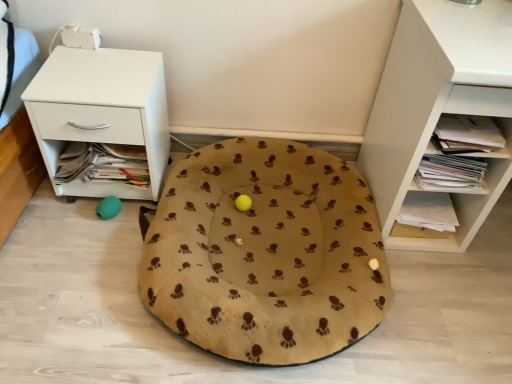
Identify the location of white glossy nightstand at left. Image resolution: width=512 pixels, height=384 pixels. (101, 111).

Find the location of a particular element. The height and width of the screenshot is (384, 512). beige fabric dog bed at center is located at coordinates (265, 253).

Image resolution: width=512 pixels, height=384 pixels. Find the location of `white glossy nightstand at left`. white glossy nightstand at left is located at coordinates (101, 111).

Is white matte shelf at right at the back of white glossy nightstand at left?

No, white glossy nightstand at left is not facing the opposite direction of white matte shelf at right.

From a real-world perspective, is white glossy nightstand at left under white matte shelf at right?

Yes.

Which is farther from the camera, (119, 66) or (435, 46)?

The point (119, 66) is behind.

Which is behind, white glossy nightstand at left or white matte shelf at right?

white glossy nightstand at left is further from the camera.

Which is correct: white matte shelf at right is inside beige fabric dog bed at center, or outside of it?

white matte shelf at right is not enclosed by beige fabric dog bed at center.

Is beige fabric dog bed at center at the back of white matte shelf at right?

That's not correct — white matte shelf at right is not looking away from beige fabric dog bed at center.

Is white matte shelf at right bigger or smaller than beige fabric dog bed at center?

Considering their sizes, white matte shelf at right takes up more space than beige fabric dog bed at center.

Measure the distance between white matte shelf at right and white glossy nightstand at left.

white matte shelf at right is 3.29 feet from white glossy nightstand at left.

Based on the photo, is white matte shelf at right wider or thinner than white glossy nightstand at left?

In the image, white matte shelf at right appears to be wider than white glossy nightstand at left.

Identify the location of nightstand on the left of white matte shelf at right. Image resolution: width=512 pixels, height=384 pixels. (101, 111).

From a real-world perspective, between white glossy nightstand at left and beige fabric dog bed at center, who is vertically higher?

white glossy nightstand at left.

Can you confirm if white glossy nightstand at left is taller than beige fabric dog bed at center?

Correct, white glossy nightstand at left is much taller as beige fabric dog bed at center.

From the image's perspective, does white glossy nightstand at left appear lower than beige fabric dog bed at center?

No, from the image's perspective, white glossy nightstand at left is not below beige fabric dog bed at center.

Does point (83, 140) come closer to viewer compared to point (320, 288)?

No, (83, 140) is behind (320, 288).

From a real-world perspective, is beige fabric dog bed at center above or below white glossy nightstand at left?

beige fabric dog bed at center is situated lower than white glossy nightstand at left in the real world.

Is white glossy nightstand at left at the back of beige fabric dog bed at center?

No, beige fabric dog bed at center's orientation is not away from white glossy nightstand at left.

Which is more to the left, beige fabric dog bed at center or white glossy nightstand at left?

From the viewer's perspective, white glossy nightstand at left appears more on the left side.

Is the surface of beige fabric dog bed at center in direct contact with white matte shelf at right?

No, beige fabric dog bed at center is not touching white matte shelf at right.

Between beige fabric dog bed at center and white matte shelf at right, which one has more height?

With more height is white matte shelf at right.

Is beige fabric dog bed at center at the right side of white matte shelf at right?

In fact, beige fabric dog bed at center is to the left of white matte shelf at right.

The width and height of the screenshot is (512, 384). What are the coordinates of `nightstand above the white matte shelf at right (from the image's perspective)` in the screenshot? It's located at (101, 111).

The width and height of the screenshot is (512, 384). In order to click on dog bed behind the white matte shelf at right in this screenshot , I will do `click(265, 253)`.

When comparing their distances from white glossy nightstand at left, does beige fabric dog bed at center or white matte shelf at right seem closer?

beige fabric dog bed at center.

Considering their positions, is white matte shelf at right positioned closer to white glossy nightstand at left than beige fabric dog bed at center?

beige fabric dog bed at center is closer to white glossy nightstand at left.

From the image, which object appears to be nearer to beige fabric dog bed at center, white matte shelf at right or white glossy nightstand at left?

Based on the image, white glossy nightstand at left appears to be nearer to beige fabric dog bed at center.

Based on their spatial positions, is beige fabric dog bed at center or white glossy nightstand at left closer to white matte shelf at right?

Among the two, beige fabric dog bed at center is located nearer to white matte shelf at right.

From the image, which object appears to be farther from white matte shelf at right, white glossy nightstand at left or beige fabric dog bed at center?

white glossy nightstand at left is positioned further to the anchor white matte shelf at right.

Considering their positions, is white glossy nightstand at left positioned further to beige fabric dog bed at center than white matte shelf at right?

The object further to beige fabric dog bed at center is white matte shelf at right.

The width and height of the screenshot is (512, 384). I want to click on dog bed between white glossy nightstand at left and white matte shelf at right in the horizontal direction, so click(x=265, y=253).